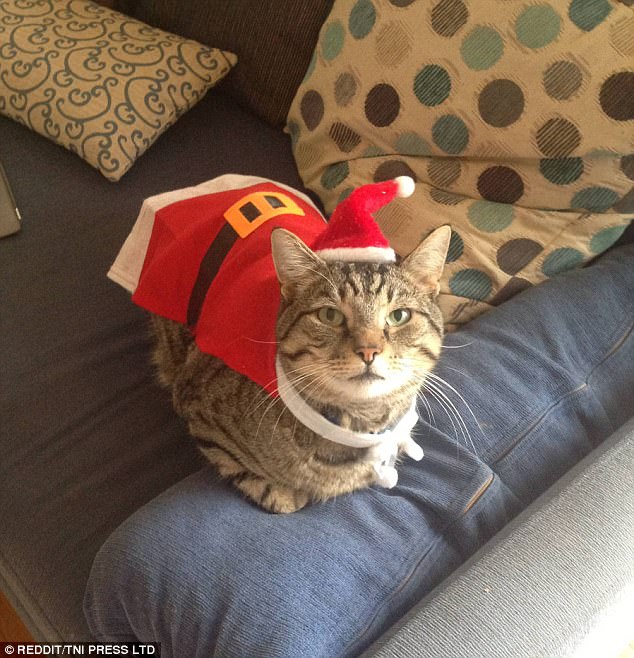
In order to click on corner of pillow in this screenshot , I will do `click(68, 288)`, `click(10, 220)`.